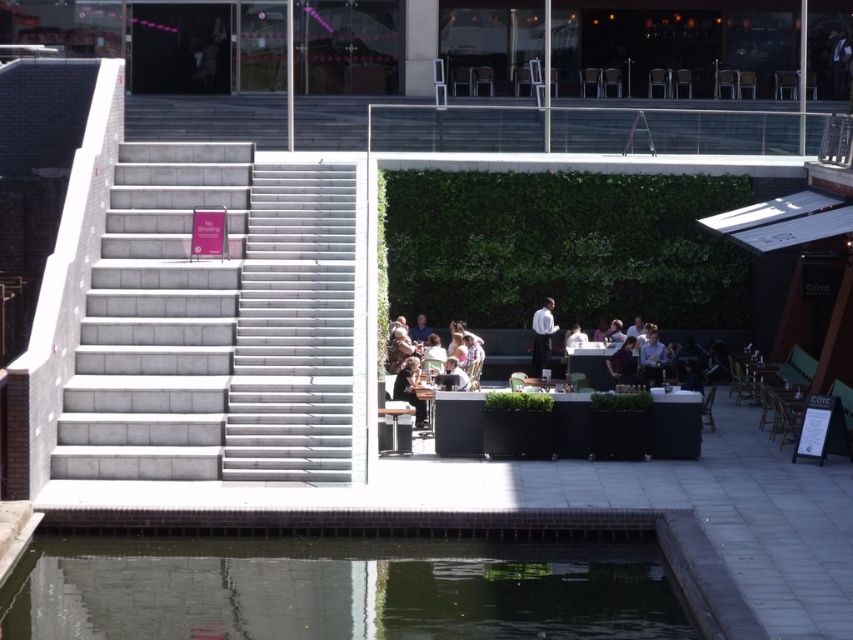
Which is more to the left, gray concrete stairs at left or matte black chair at center?

From the viewer's perspective, gray concrete stairs at left appears more on the left side.

Measure the distance between point (108, 380) and camera.

Point (108, 380) is 23.05 meters from camera.

Who is more forward, [234,292] or [459,364]?

Point [234,292] is in front.

The width and height of the screenshot is (853, 640). In order to click on gray concrete stairs at left in this screenshot , I will do `click(213, 323)`.

Is black leather jacket at center taller than dark brown leather jacket at center?

Yes, black leather jacket at center is taller than dark brown leather jacket at center.

Does black leather jacket at center have a lesser height compared to dark brown leather jacket at center?

No, black leather jacket at center is not shorter than dark brown leather jacket at center.

Is point (412, 364) positioned in front of point (614, 380)?

Yes, point (412, 364) is in front of point (614, 380).

The height and width of the screenshot is (640, 853). In order to click on black leather jacket at center in this screenshot , I will do `click(410, 388)`.

Is white matte shirt at center positioned before black leather jacket at center?

No, it is behind black leather jacket at center.

Between white matte shirt at center and black leather jacket at center, which one has less height?

Standing shorter between the two is black leather jacket at center.

Does point (550, 304) lie in front of point (403, 369)?

No.

At what (x,y) coordinates should I click in order to perform the action: click on white matte shirt at center. Please return your answer as a coordinate pair (x, y). The width and height of the screenshot is (853, 640). Looking at the image, I should click on (543, 336).